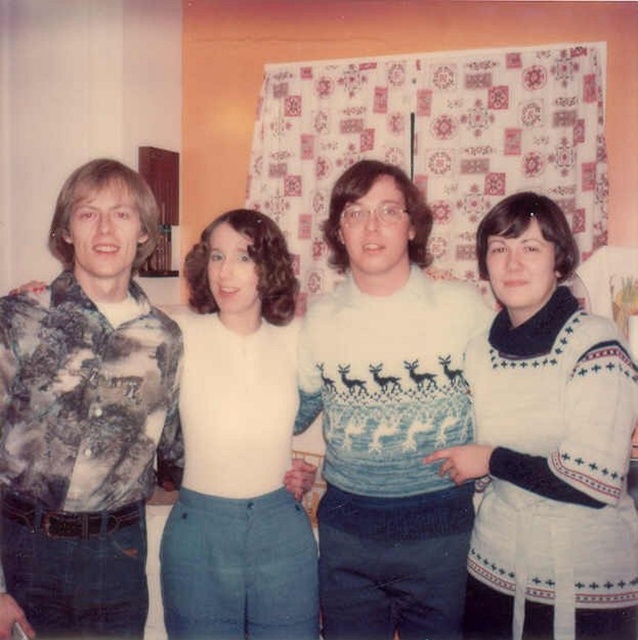
Does point (135, 237) come farther from viewer compared to point (584, 442)?

Yes, point (135, 237) is behind point (584, 442).

Is printed fabric shirt at left further to the viewer compared to white knitted sweater at center?

That is False.

Which is behind, point (15, 292) or point (478, 536)?

Point (478, 536)

This screenshot has height=640, width=638. Find the location of `printed fabric shirt at left`. printed fabric shirt at left is located at coordinates (84, 416).

Is point (68, 584) closer to camera compared to point (237, 227)?

Yes.

Between printed fabric shirt at left and white matte sweater at center, which one appears on the left side from the viewer's perspective?

printed fabric shirt at left is more to the left.

Between point (100, 221) and point (193, 598), which one is positioned in front?

Point (100, 221)

Where is `printed fabric shirt at left`? This screenshot has height=640, width=638. printed fabric shirt at left is located at coordinates (84, 416).

Which of these two, white knitted sweater at center or white matte sweater at center, stands shorter?

white knitted sweater at center is shorter.

Does point (553, 241) lie behind point (271, 264)?

No.

This screenshot has width=638, height=640. I want to click on white knitted sweater at center, so click(547, 444).